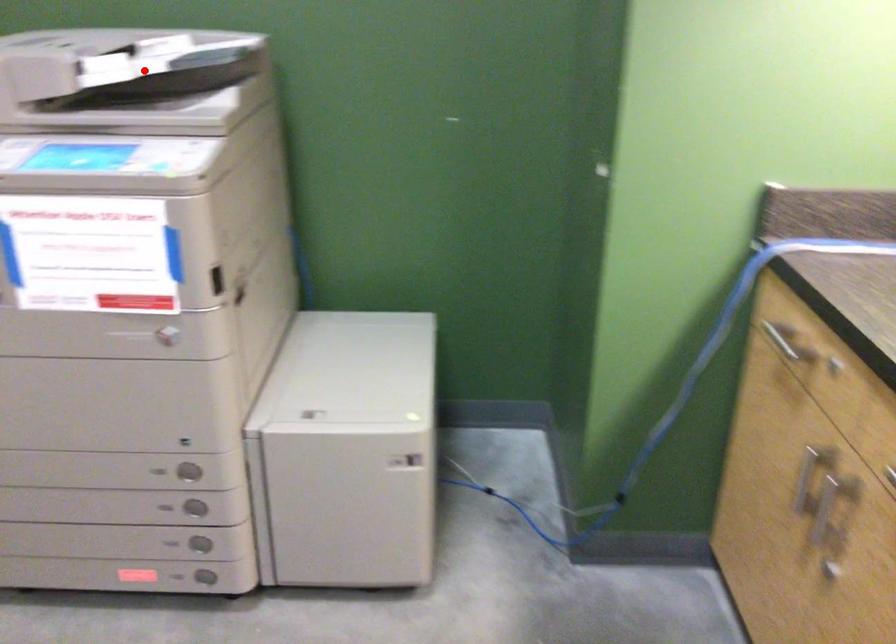
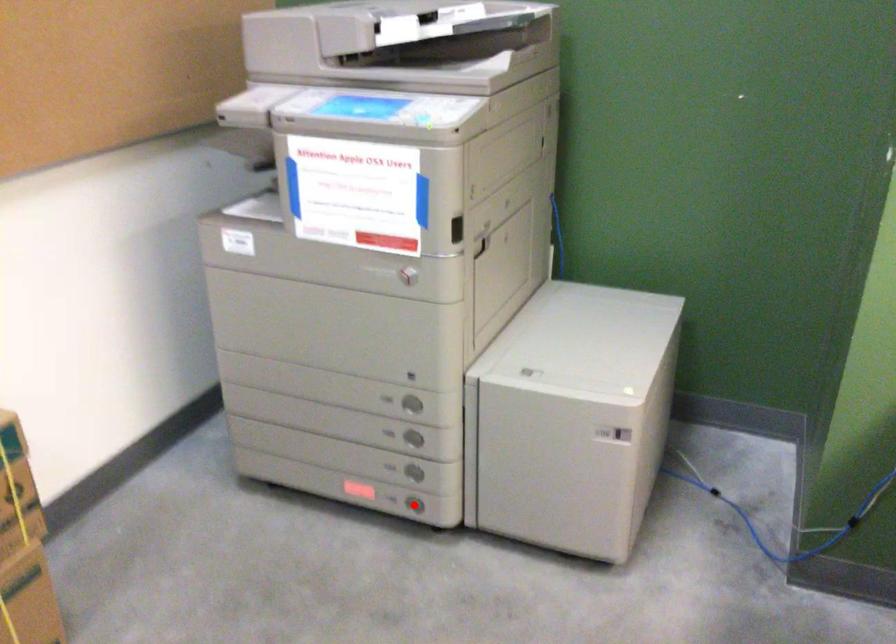
I am providing you with two images of the same scene from different viewpoints. A red point is marked on the first image and another point is marked on the second image. Does the point marked in image1 correspond to the same location as the one in image2?

No